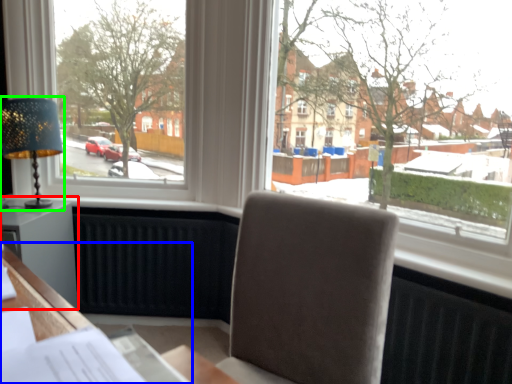
Question: Which is farther away from table (highlighted by a red box)? desk (highlighted by a blue box) or table lamp (highlighted by a green box)?

Choices:
 (A) desk
 (B) table lamp

Answer: (A)